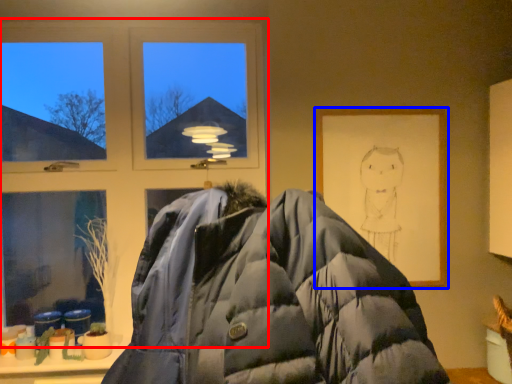
Question: Which object is closer to the camera taking this photo, window (highlighted by a red box) or picture frame (highlighted by a blue box)?

Choices:
 (A) window
 (B) picture frame

Answer: (B)